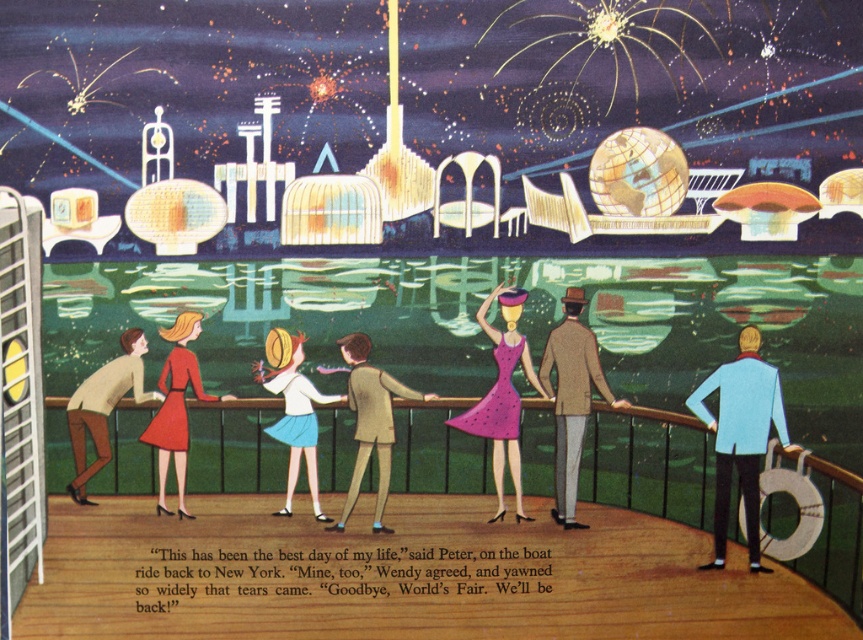
Between point (518, 468) and point (287, 419), which one is positioned behind?

Positioned behind is point (518, 468).

Does purple dotted dress at center appear under light blue fabric skirt at center?

Actually, purple dotted dress at center is above light blue fabric skirt at center.

Does point (498, 289) lie behind point (279, 436)?

No, (498, 289) is closer to viewer.

What are the coordinates of `purple dotted dress at center` in the screenshot? It's located at (502, 394).

Between light blue fabric jacket at right and matte red dress at lower left, which one has more height?

light blue fabric jacket at right

Does point (722, 468) come in front of point (175, 467)?

No, (722, 468) is further to viewer.

Describe the element at coordinates (741, 435) in the screenshot. I see `light blue fabric jacket at right` at that location.

Locate an element on the screen. light blue fabric jacket at right is located at coordinates (741, 435).

Does light blue fabric jacket at right appear over light brown wool coat at center?

No.

Between point (732, 397) and point (574, 433), which one is positioned in front?

Positioned in front is point (574, 433).

You are a GUI agent. You are given a task and a screenshot of the screen. Output one action in this format:
    pyautogui.click(x=<x>, y=<y>)
    Task: Click on the light blue fabric jacket at right
    
    Given the screenshot: What is the action you would take?
    pyautogui.click(x=741, y=435)